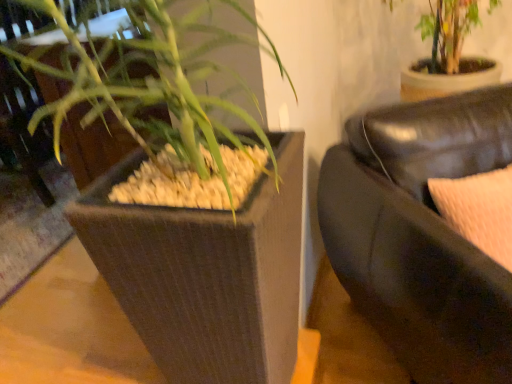
Question: Is brown textured planter at left in front of green leafy plant at upper left?

Choices:
 (A) no
 (B) yes

Answer: (A)

Question: Can you confirm if brown textured planter at left is shorter than green leafy plant at upper left?

Choices:
 (A) yes
 (B) no

Answer: (A)

Question: From a real-world perspective, does brown textured planter at left sit lower than green leafy plant at upper left?

Choices:
 (A) no
 (B) yes

Answer: (B)

Question: Is brown textured planter at left looking in the opposite direction of green leafy plant at upper left?

Choices:
 (A) no
 (B) yes

Answer: (A)

Question: Considering the relative sizes of brown textured planter at left and green leafy plant at upper left in the image provided, is brown textured planter at left bigger than green leafy plant at upper left?

Choices:
 (A) yes
 (B) no

Answer: (B)

Question: Would you say brown textured planter at left is to the left or to the right of black leather couch at right in the picture?

Choices:
 (A) left
 (B) right

Answer: (A)

Question: Considering the positions of brown textured planter at left and black leather couch at right in the image, is brown textured planter at left wider or thinner than black leather couch at right?

Choices:
 (A) thin
 (B) wide

Answer: (B)

Question: Is point (279, 144) closer or farther from the camera than point (468, 352)?

Choices:
 (A) closer
 (B) farther

Answer: (B)

Question: Considering the positions of brown textured planter at left and black leather couch at right in the image, is brown textured planter at left taller or shorter than black leather couch at right?

Choices:
 (A) tall
 (B) short

Answer: (B)

Question: Based on their positions, is black leather couch at right located to the left or right of green leafy plant at upper left?

Choices:
 (A) left
 (B) right

Answer: (B)

Question: In terms of width, does black leather couch at right look wider or thinner when compared to green leafy plant at upper left?

Choices:
 (A) thin
 (B) wide

Answer: (B)

Question: Would you say black leather couch at right is inside or outside green leafy plant at upper left?

Choices:
 (A) inside
 (B) outside

Answer: (B)

Question: Considering the positions of black leather couch at right and green leafy plant at upper left in the image, is black leather couch at right taller or shorter than green leafy plant at upper left?

Choices:
 (A) short
 (B) tall

Answer: (A)

Question: Is green leafy plant at upper left wider or thinner than brown textured planter at left?

Choices:
 (A) wide
 (B) thin

Answer: (B)

Question: From the image's perspective, is green leafy plant at upper left above or below brown textured planter at left?

Choices:
 (A) below
 (B) above

Answer: (B)